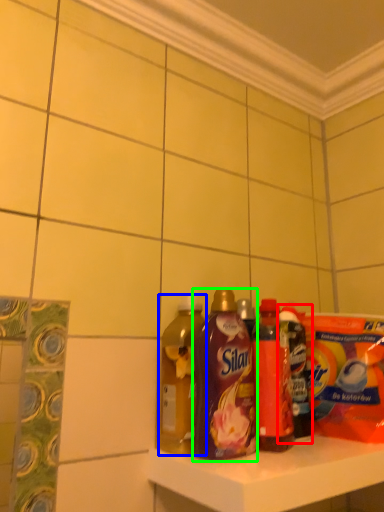
Question: Considering the real-world distances, which object is closest to bottle (highlighted by a red box)? bottle (highlighted by a blue box) or bottle (highlighted by a green box).

Choices:
 (A) bottle
 (B) bottle

Answer: (B)